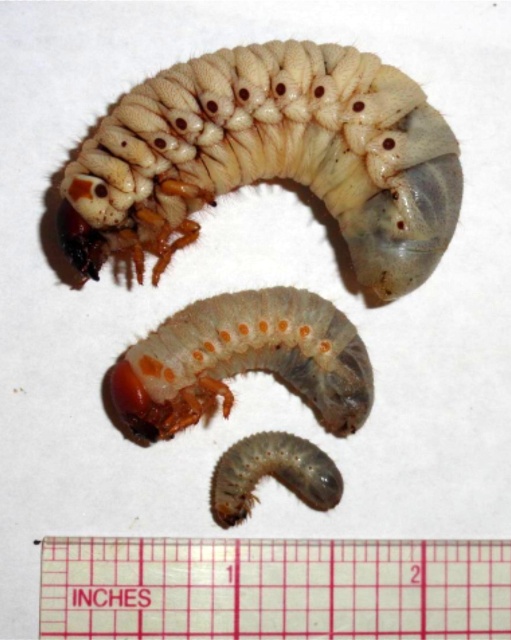
From the picture: You are an entomologist examining two caterpillars in an image. You notice the translucent white caterpillar at upper center and the translucent rubber caterpillar at lower center. Which caterpillar is positioned to the left of the other?

The translucent white caterpillar at upper center is positioned to the left of the translucent rubber caterpillar at lower center.

You are a researcher examining the image of two beetle larvae. You notice two points marked on the image. One is at coordinate point[281,625] and the other at point[359,355]. Which of these points is closer to your viewpoint as you look at the image?

Point[281,625] is closer to the camera than point[359,355].